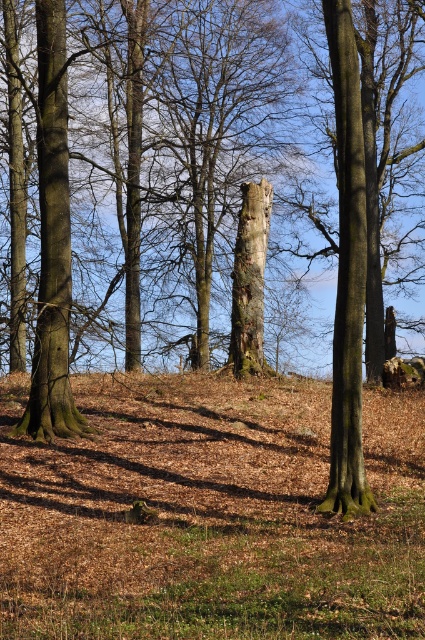
You are standing in the forest and want to touch both the smooth brown tree trunk at right and the smooth brown tree trunk at left. Which one should you approach first to reach the closer one first?

You should approach the smooth brown tree trunk at right first because it is closer to the viewer than the smooth brown tree trunk at left.

You are standing in the forest and want to find the taller tree between the smooth brown tree trunk at right and the smooth brown tree trunk at center. Which one should you look towards?

The smooth brown tree trunk at right is taller than the smooth brown tree trunk at center, so you should look towards the right.

You are a hiker standing in the forest and want to take a photo of both the smooth brown tree trunk at right and the smooth brown tree trunk at left. Based on their positions, which tree trunk should you focus on first to ensure both are in the frame?

The smooth brown tree trunk at right is above the smooth brown tree trunk at left, so you should focus on the lower one first to ensure both are in the frame.